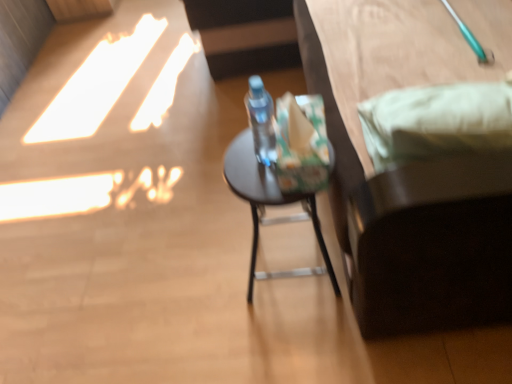
Question: Relative to transparent plastic bottle at center, is matte black stool at center in front or behind?

Choices:
 (A) front
 (B) behind

Answer: (B)

Question: Would you say matte black stool at center is inside or outside transparent plastic bottle at center?

Choices:
 (A) inside
 (B) outside

Answer: (B)

Question: Which of these objects is positioned farthest from the matte black stool at center?

Choices:
 (A) transparent plastic bottle at center
 (B) dark brown wooden bed at right

Answer: (B)

Question: Which is farther from the transparent plastic bottle at center?

Choices:
 (A) dark brown wooden bed at right
 (B) matte black stool at center

Answer: (A)